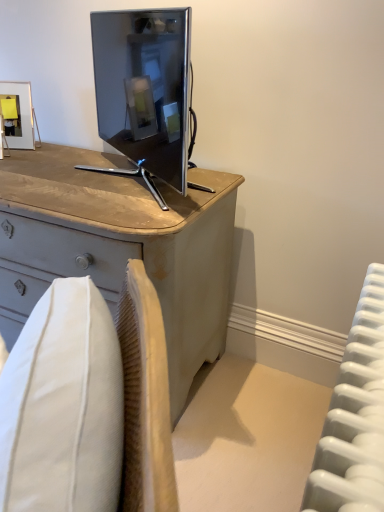
Looking at this image, what is the approximate width of white plastic radiator at right?

7.75 inches.

Locate an element on the screen. This screenshot has width=384, height=512. white plastic radiator at right is located at coordinates (355, 416).

What is the approximate height of light gray wood desk at center?

3.30 feet.

This screenshot has width=384, height=512. Find the location of `white plastic radiator at right`. white plastic radiator at right is located at coordinates (355, 416).

Is matte black tv at center oriented towards light gray wood desk at center?

No.

Based on the photo, does matte black tv at center touch light gray wood desk at center?

There is a gap between matte black tv at center and light gray wood desk at center.

Considering the relative positions of matte black tv at center and light gray wood desk at center in the image provided, is matte black tv at center to the left or to the right of light gray wood desk at center?

Based on their positions, matte black tv at center is located to the right of light gray wood desk at center.

Does metallic gold picture frame at upper left have a smaller size compared to white plastic radiator at right?

Correct, metallic gold picture frame at upper left occupies less space than white plastic radiator at right.

At what (x,y) coordinates should I click in order to perform the action: click on picture frame behind the white plastic radiator at right. Please return your answer as a coordinate pair (x, y). Looking at the image, I should click on 17,114.

Considering the positions of objects metallic gold picture frame at upper left and white plastic radiator at right in the image provided, who is more to the left, metallic gold picture frame at upper left or white plastic radiator at right?

metallic gold picture frame at upper left is more to the left.

Is metallic gold picture frame at upper left touching white plastic radiator at right?

metallic gold picture frame at upper left and white plastic radiator at right are not in contact.

From the image's perspective, which one is positioned higher, metallic gold picture frame at upper left or matte black tv at center?

metallic gold picture frame at upper left is shown above in the image.

From the picture: Who is taller, metallic gold picture frame at upper left or matte black tv at center?

matte black tv at center is taller.

Could you tell me if metallic gold picture frame at upper left is facing matte black tv at center?

No, metallic gold picture frame at upper left is not oriented towards matte black tv at center.

From a real-world perspective, is metallic gold picture frame at upper left below matte black tv at center?

Correct, in the physical world, metallic gold picture frame at upper left is lower than matte black tv at center.

From a real-world perspective, is light gray wood desk at center beneath metallic gold picture frame at upper left?

Yes, from a real-world perspective, light gray wood desk at center is below metallic gold picture frame at upper left.

Is light gray wood desk at center turned away from metallic gold picture frame at upper left?

No, light gray wood desk at center's orientation is not away from metallic gold picture frame at upper left.

Which object is more forward, light gray wood desk at center or metallic gold picture frame at upper left?

light gray wood desk at center is in front.

Is point (144, 211) farther from camera compared to point (28, 119)?

That is False.

Is light gray wood desk at center outside of white plastic radiator at right?

Yes, light gray wood desk at center is outside of white plastic radiator at right.

Is light gray wood desk at center further to the viewer compared to white plastic radiator at right?

No.

Based on the photo, from a real-world perspective, which object stands above the other?

light gray wood desk at center is physically above.

In the image, there is a white plastic radiator at right. Where is `desk above it (from the image's perspective)`? The width and height of the screenshot is (384, 512). desk above it (from the image's perspective) is located at coordinates (119, 247).

From the image's perspective, is matte black tv at center beneath white plastic radiator at right?

No, from the image's perspective, matte black tv at center is not beneath white plastic radiator at right.

Considering the sizes of objects matte black tv at center and white plastic radiator at right in the image provided, who is smaller, matte black tv at center or white plastic radiator at right?

Smaller between the two is white plastic radiator at right.

Considering the relative positions of matte black tv at center and white plastic radiator at right in the image provided, is matte black tv at center to the left or to the right of white plastic radiator at right?

From the image, it's evident that matte black tv at center is to the left of white plastic radiator at right.

Considering the sizes of objects matte black tv at center and white plastic radiator at right in the image provided, who is shorter, matte black tv at center or white plastic radiator at right?

matte black tv at center.

Between white plastic radiator at right and metallic gold picture frame at upper left, which one has larger size?

Bigger between the two is white plastic radiator at right.

In the image, there is a metallic gold picture frame at upper left. Where is `radiator below it (from the image's perspective)`? This screenshot has height=512, width=384. radiator below it (from the image's perspective) is located at coordinates [355, 416].

In the image, there is a matte black tv at center. Identify the location of desk below it (from a real-world perspective). (119, 247).

I want to click on picture frame above the white plastic radiator at right (from a real-world perspective), so click(17, 114).

Looking at the image, which one is located closer to matte black tv at center, metallic gold picture frame at upper left or light gray wood desk at center?

Based on the image, light gray wood desk at center appears to be nearer to matte black tv at center.

Based on their spatial positions, is metallic gold picture frame at upper left or light gray wood desk at center closer to white plastic radiator at right?

Among the two, light gray wood desk at center is located nearer to white plastic radiator at right.

Looking at the image, which one is located closer to matte black tv at center, light gray wood desk at center or metallic gold picture frame at upper left?

The object closer to matte black tv at center is light gray wood desk at center.

Which object lies nearer to the anchor point metallic gold picture frame at upper left, light gray wood desk at center or white plastic radiator at right?

The object closer to metallic gold picture frame at upper left is light gray wood desk at center.

When comparing their distances from matte black tv at center, does white plastic radiator at right or metallic gold picture frame at upper left seem closer?

metallic gold picture frame at upper left is closer to matte black tv at center.

Considering their positions, is matte black tv at center positioned closer to metallic gold picture frame at upper left than white plastic radiator at right?

matte black tv at center.

Based on their spatial positions, is matte black tv at center or metallic gold picture frame at upper left closer to light gray wood desk at center?

Based on the image, matte black tv at center appears to be nearer to light gray wood desk at center.

Based on their spatial positions, is matte black tv at center or light gray wood desk at center closer to metallic gold picture frame at upper left?

matte black tv at center is positioned closer to the anchor metallic gold picture frame at upper left.

Where is `television positioned between white plastic radiator at right and metallic gold picture frame at upper left from near to far`? television positioned between white plastic radiator at right and metallic gold picture frame at upper left from near to far is located at coordinates 144,91.

This screenshot has height=512, width=384. I want to click on desk that lies between matte black tv at center and white plastic radiator at right from top to bottom, so click(x=119, y=247).

You are a GUI agent. You are given a task and a screenshot of the screen. Output one action in this format:
    pyautogui.click(x=<x>, y=<y>)
    Task: Click on the television positioned between light gray wood desk at center and metallic gold picture frame at upper left from near to far
    The height and width of the screenshot is (512, 384).
    Given the screenshot: What is the action you would take?
    pyautogui.click(x=144, y=91)

You are a GUI agent. You are given a task and a screenshot of the screen. Output one action in this format:
    pyautogui.click(x=<x>, y=<y>)
    Task: Click on the radiator between light gray wood desk at center and metallic gold picture frame at upper left from front to back
    
    Given the screenshot: What is the action you would take?
    pyautogui.click(x=355, y=416)